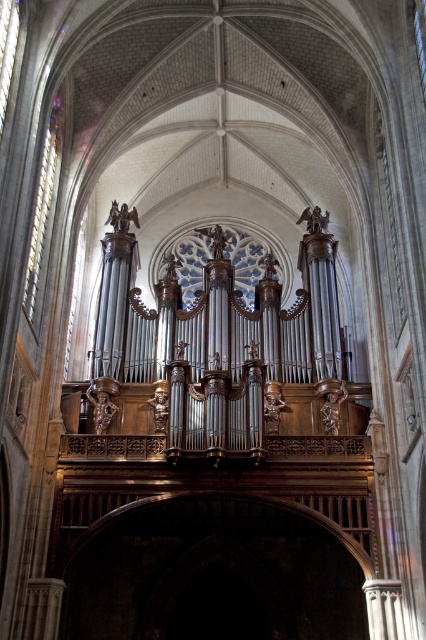
Question: Is transparent stained glass at center positioned behind clear glass window at left?

Choices:
 (A) yes
 (B) no

Answer: (A)

Question: Which point appears closest to the camera in this image?

Choices:
 (A) (37, 208)
 (B) (207, 248)

Answer: (A)

Question: Which of the following is the farthest from the observer?

Choices:
 (A) clear glass window at left
 (B) transparent stained glass at center

Answer: (B)

Question: Observing the image, what is the correct spatial positioning of transparent stained glass at center in reference to clear glass window at left?

Choices:
 (A) right
 (B) left

Answer: (A)

Question: Among these points, which one is nearest to the camera?

Choices:
 (A) (62, 113)
 (B) (235, 269)

Answer: (A)

Question: Is transparent stained glass at center to the right of clear glass window at left from the viewer's perspective?

Choices:
 (A) yes
 (B) no

Answer: (A)